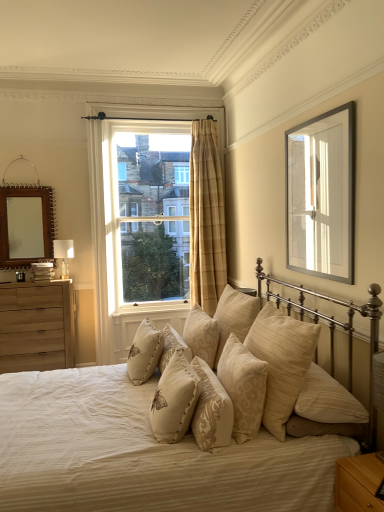
Question: From a real-world perspective, is beige fabric pillow at center, which is the 7th pillow in right-to-left order, located beneath beige textured pillow at center, marked as the 5th pillow in a right-to-left arrangement?

Choices:
 (A) no
 (B) yes

Answer: (B)

Question: From the image's perspective, does beige fabric pillow at center, the 2th pillow viewed from the left, appear lower than beige textured pillow at center, which appears as the fourth pillow when viewed from the left?

Choices:
 (A) no
 (B) yes

Answer: (B)

Question: Is the surface of beige fabric pillow at center, the 2th pillow viewed from the left, in direct contact with beige textured pillow at center, which appears as the fourth pillow when viewed from the left?

Choices:
 (A) yes
 (B) no

Answer: (B)

Question: Considering the relative sizes of beige fabric pillow at center, which is the 7th pillow in right-to-left order, and beige textured pillow at center, which appears as the fourth pillow when viewed from the left, in the image provided, is beige fabric pillow at center, which is the 7th pillow in right-to-left order, thinner than beige textured pillow at center, which appears as the fourth pillow when viewed from the left,?

Choices:
 (A) no
 (B) yes

Answer: (B)

Question: Does beige fabric pillow at center, the 2th pillow viewed from the left, come behind beige textured pillow at center, marked as the 5th pillow in a right-to-left arrangement?

Choices:
 (A) no
 (B) yes

Answer: (A)

Question: From the image's perspective, is silver metallic picture frame at upper right located above or below beige textured curtain at center?

Choices:
 (A) below
 (B) above

Answer: (B)

Question: Considering the positions of silver metallic picture frame at upper right and beige textured curtain at center in the image, is silver metallic picture frame at upper right taller or shorter than beige textured curtain at center?

Choices:
 (A) short
 (B) tall

Answer: (A)

Question: From a real-world perspective, is silver metallic picture frame at upper right positioned above or below beige textured curtain at center?

Choices:
 (A) below
 (B) above

Answer: (B)

Question: Which is correct: silver metallic picture frame at upper right is inside beige textured curtain at center, or outside of it?

Choices:
 (A) inside
 (B) outside

Answer: (B)

Question: Which is correct: white fabric lampshade at left is inside wooden mirror at upper left, or outside of it?

Choices:
 (A) inside
 (B) outside

Answer: (B)

Question: Does point (59, 247) appear closer or farther from the camera than point (13, 263)?

Choices:
 (A) closer
 (B) farther

Answer: (B)

Question: From a real-world perspective, is white fabric lampshade at left physically located above or below wooden mirror at upper left?

Choices:
 (A) above
 (B) below

Answer: (B)

Question: Is white fabric lampshade at left bigger or smaller than wooden mirror at upper left?

Choices:
 (A) small
 (B) big

Answer: (A)

Question: From the image's perspective, relative to light brown wood nightstand at lower right, is beige fabric bed at center above or below?

Choices:
 (A) below
 (B) above

Answer: (B)

Question: Based on their positions, is beige fabric bed at center located to the left or right of light brown wood nightstand at lower right?

Choices:
 (A) right
 (B) left

Answer: (B)